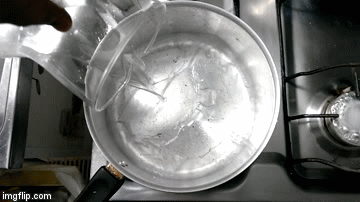
Image resolution: width=360 pixels, height=202 pixels. In order to click on pot in this screenshot , I will do `click(193, 105)`.